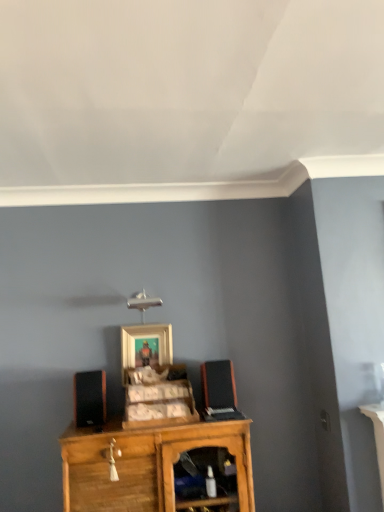
Question: Is wooden picture frame at center at the back of black matte speaker at left, positioned as the 1th speaker in left-to-right order?

Choices:
 (A) no
 (B) yes

Answer: (A)

Question: Is black matte speaker at left, positioned as the 1th speaker in left-to-right order, wider than wooden picture frame at center?

Choices:
 (A) no
 (B) yes

Answer: (B)

Question: Is black matte speaker at left, the second speaker positioned from the right, to the right of wooden picture frame at center from the viewer's perspective?

Choices:
 (A) yes
 (B) no

Answer: (B)

Question: Is there a large distance between black matte speaker at left, positioned as the 1th speaker in left-to-right order, and wooden picture frame at center?

Choices:
 (A) yes
 (B) no

Answer: (B)

Question: Considering the relative sizes of black matte speaker at left, the second speaker positioned from the right, and wooden picture frame at center in the image provided, is black matte speaker at left, the second speaker positioned from the right, shorter than wooden picture frame at center?

Choices:
 (A) no
 (B) yes

Answer: (B)

Question: Does black matte speaker at left, the second speaker positioned from the right, have a greater height compared to wooden picture frame at center?

Choices:
 (A) no
 (B) yes

Answer: (A)

Question: Does wooden cabinet at center appear on the right side of black matte speaker at left, positioned as the 1th speaker in left-to-right order?

Choices:
 (A) no
 (B) yes

Answer: (B)

Question: Does wooden cabinet at center have a greater height compared to black matte speaker at left, positioned as the 1th speaker in left-to-right order?

Choices:
 (A) no
 (B) yes

Answer: (B)

Question: Could you tell me if wooden cabinet at center is turned towards black matte speaker at left, positioned as the 1th speaker in left-to-right order?

Choices:
 (A) yes
 (B) no

Answer: (B)

Question: From the image's perspective, does wooden cabinet at center appear lower than black matte speaker at left, positioned as the 1th speaker in left-to-right order?

Choices:
 (A) no
 (B) yes

Answer: (B)

Question: From the image's perspective, is wooden cabinet at center on black matte speaker at left, positioned as the 1th speaker in left-to-right order?

Choices:
 (A) yes
 (B) no

Answer: (B)

Question: Is wooden cabinet at center positioned far away from black matte speaker at left, the second speaker positioned from the right?

Choices:
 (A) no
 (B) yes

Answer: (A)

Question: From a real-world perspective, is wooden cabinet at center positioned over wooden cabinet at center based on gravity?

Choices:
 (A) yes
 (B) no

Answer: (A)